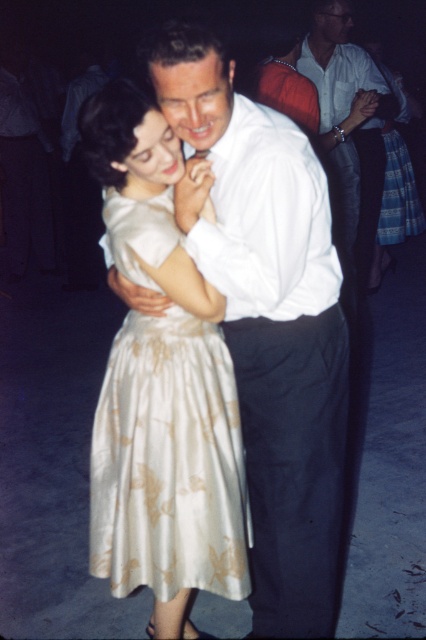
Question: Does white satin dress at center have a greater width compared to white smooth shirt at upper center?

Choices:
 (A) no
 (B) yes

Answer: (A)

Question: Is white satin dress at center further to the viewer compared to white smooth shirt at upper center?

Choices:
 (A) no
 (B) yes

Answer: (A)

Question: Among these objects, which one is farthest from the camera?

Choices:
 (A) white satin dress at center
 (B) white smooth shirt at upper center

Answer: (B)

Question: Which of the following is the farthest from the observer?

Choices:
 (A) (172, 388)
 (B) (374, 221)

Answer: (B)

Question: Does white satin dress at center have a greater width compared to white smooth shirt at upper center?

Choices:
 (A) yes
 (B) no

Answer: (B)

Question: Among these points, which one is nearest to the camera?

Choices:
 (A) (227, 538)
 (B) (370, 122)

Answer: (A)